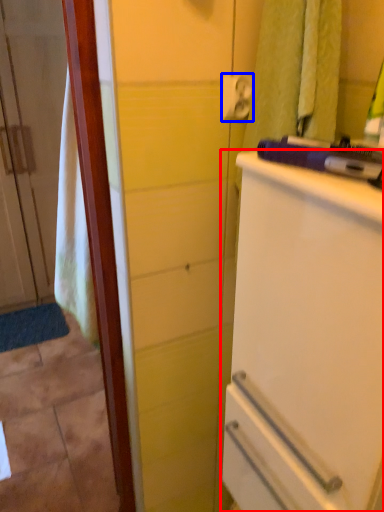
Question: Which of the following is the farthest to the observer, refrigerator (highlighted by a red box) or towel bar (highlighted by a blue box)?

Choices:
 (A) refrigerator
 (B) towel bar

Answer: (B)